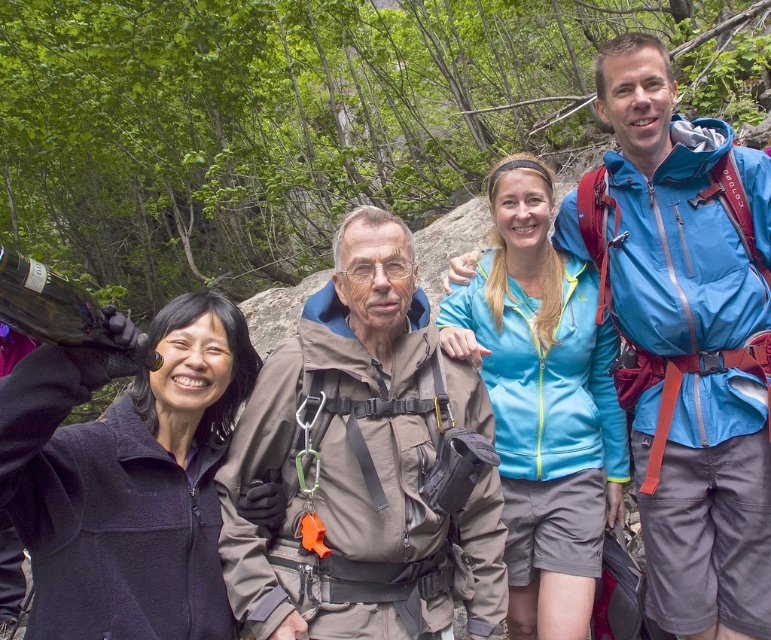
Question: Which point is closer to the camera taking this photo?

Choices:
 (A) (348, 330)
 (B) (79, 452)

Answer: (B)

Question: Is matte brown jacket at center closer to the viewer compared to dark purple fleece jacket at upper left?

Choices:
 (A) no
 (B) yes

Answer: (A)

Question: Estimate the real-world distances between objects in this image. Which object is farther from the blue synthetic jacket at center?

Choices:
 (A) matte brown jacket at center
 (B) dark purple fleece jacket at upper left

Answer: (B)

Question: Is blue synthetic jacket at center above matte brown jacket at center?

Choices:
 (A) yes
 (B) no

Answer: (A)

Question: Among these points, which one is farthest from the camera?

Choices:
 (A) (177, 364)
 (B) (692, 134)

Answer: (B)

Question: Is matte brown jacket at center bigger than light blue fleece jacket at center?

Choices:
 (A) yes
 (B) no

Answer: (B)